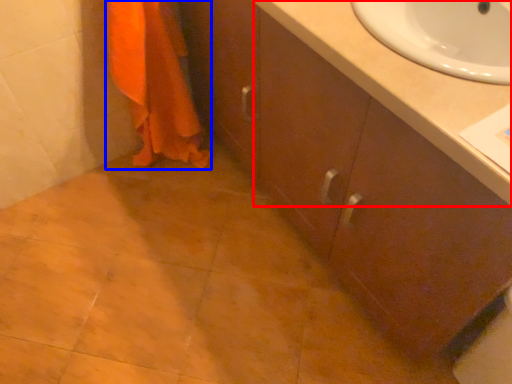
Question: Which object is closer to the camera taking this photo, counter top (highlighted by a red box) or bath towel (highlighted by a blue box)?

Choices:
 (A) counter top
 (B) bath towel

Answer: (A)